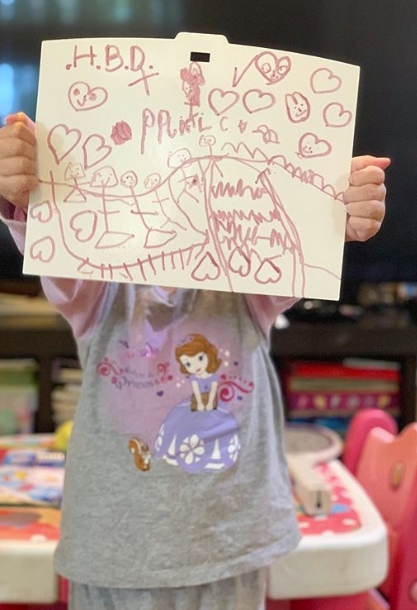
Locate an element on the screen. chair is located at coordinates (404, 490).